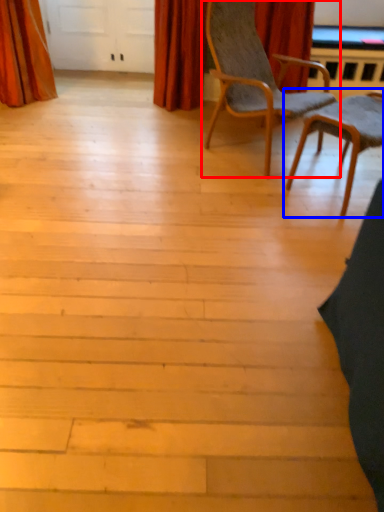
Question: Which object appears farthest to the camera in this image, chair (highlighted by a red box) or chair (highlighted by a blue box)?

Choices:
 (A) chair
 (B) chair

Answer: (B)